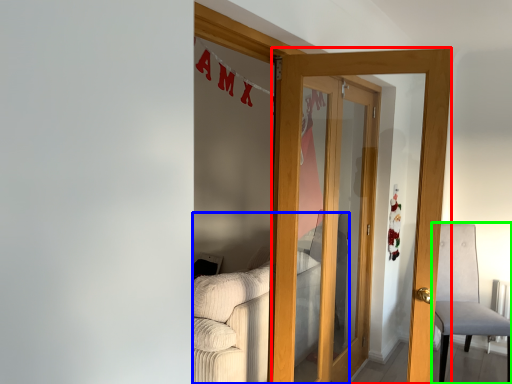
Question: Which object is the closest to the door (highlighted by a red box)? Choose among these: couch (highlighted by a blue box) or chair (highlighted by a green box).

Choices:
 (A) couch
 (B) chair

Answer: (A)